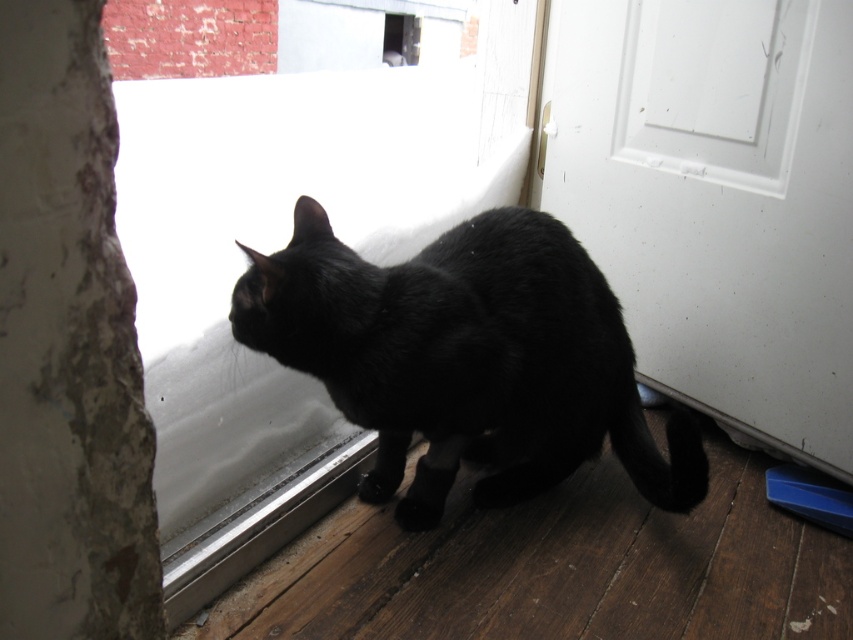
Between transparent glass window at center and black matte fur cat at center, which one has less height?

black matte fur cat at center

In the scene shown: Does transparent glass window at center have a greater width compared to black matte fur cat at center?

Yes.

You are a GUI agent. You are given a task and a screenshot of the screen. Output one action in this format:
    pyautogui.click(x=<x>, y=<y>)
    Task: Click on the transparent glass window at center
    Image resolution: width=853 pixels, height=640 pixels.
    Given the screenshot: What is the action you would take?
    pyautogui.click(x=283, y=243)

Identify the location of transparent glass window at center. This screenshot has width=853, height=640. tap(283, 243).

Is transparent glass window at center to the right of white glossy screen door at lower right from the viewer's perspective?

No, transparent glass window at center is not to the right of white glossy screen door at lower right.

Between point (225, 388) and point (676, 122), which one is positioned behind?

The point (676, 122) is behind.

The width and height of the screenshot is (853, 640). I want to click on transparent glass window at center, so click(x=283, y=243).

Is white glossy screen door at lower right bigger than black matte fur cat at center?

Correct, white glossy screen door at lower right is larger in size than black matte fur cat at center.

The width and height of the screenshot is (853, 640). I want to click on white glossy screen door at lower right, so click(x=718, y=200).